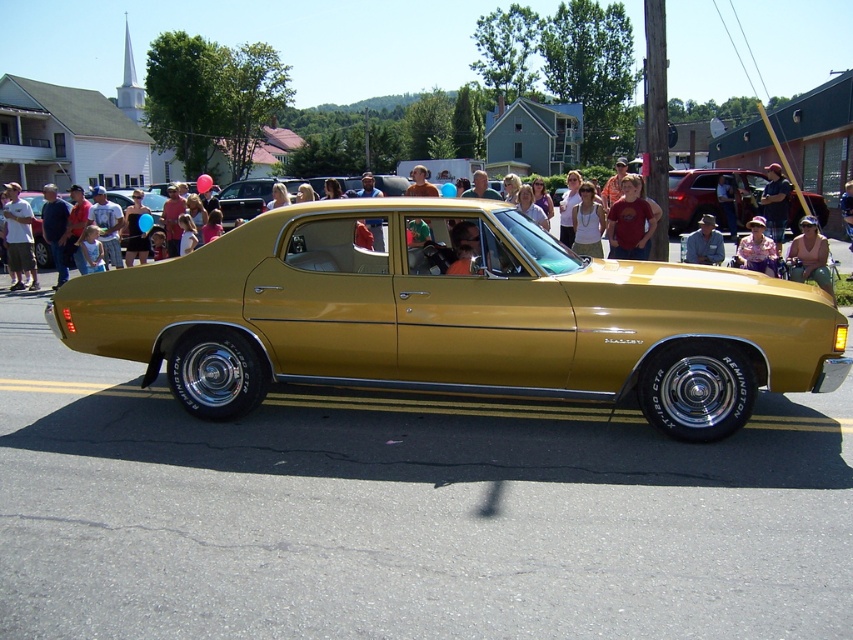
Looking at this image, is the position of matte red shirt at center less distant than that of dark blue shirt at center?

Yes, it is in front of dark blue shirt at center.

Can you confirm if matte red shirt at center is smaller than dark blue shirt at center?

Correct, matte red shirt at center occupies less space than dark blue shirt at center.

Find the location of `matte red shirt at center`. matte red shirt at center is located at coordinates [x=630, y=221].

At what (x,y) coordinates should I click in order to perform the action: click on matte red shirt at center. Please return your answer as a coordinate pair (x, y). Looking at the image, I should click on (630, 221).

Does matte black shirt at left lie in front of matte gold car at center?

No, it is behind matte gold car at center.

Does matte black shirt at left have a lesser height compared to matte gold car at center?

In fact, matte black shirt at left may be taller than matte gold car at center.

Is point (30, 224) closer to camera compared to point (798, 278)?

No.

Find the location of a particular element. The height and width of the screenshot is (640, 853). matte black shirt at left is located at coordinates (18, 237).

Does point (622, 236) lie behind point (22, 262)?

No, it is not.

What do you see at coordinates (630, 221) in the screenshot? I see `matte red shirt at center` at bounding box center [630, 221].

Describe the element at coordinates (630, 221) in the screenshot. This screenshot has height=640, width=853. I see `matte red shirt at center` at that location.

The width and height of the screenshot is (853, 640). In order to click on matte red shirt at center in this screenshot , I will do `click(630, 221)`.